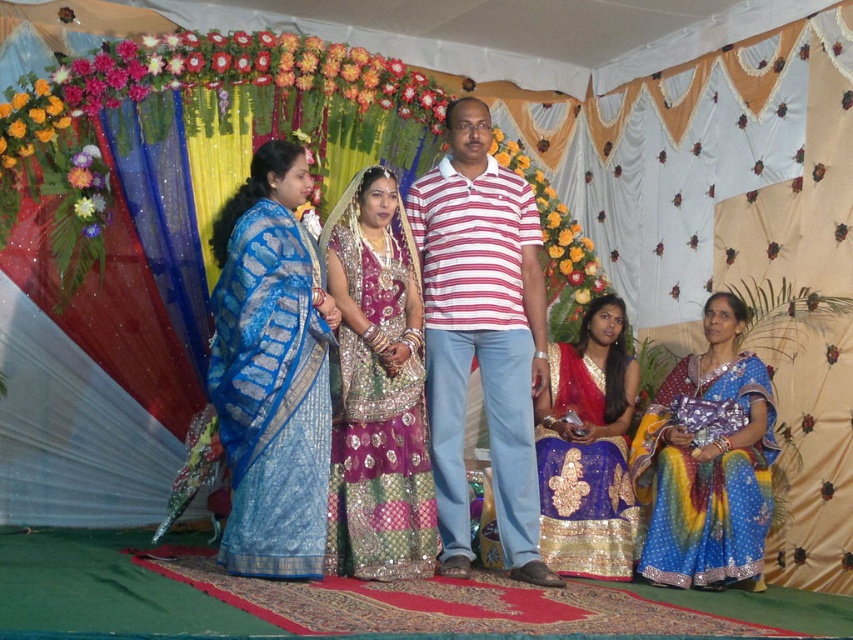
Looking at this image, you are standing at the entrance of the pavilion and want to find the striped cotton polo shirt at center. According to the coordinates provided, where should you look to locate it?

The striped cotton polo shirt at center is located at the 2D coordinates point (x=480, y=336), so you should look towards the center of the pavilion to find it.

You are standing in the center of the image and want to move towards the striped cotton polo shirt at center. In which direction should you move?

The striped cotton polo shirt at center is already at the center of the image, so you don not need to move in any direction to reach it.